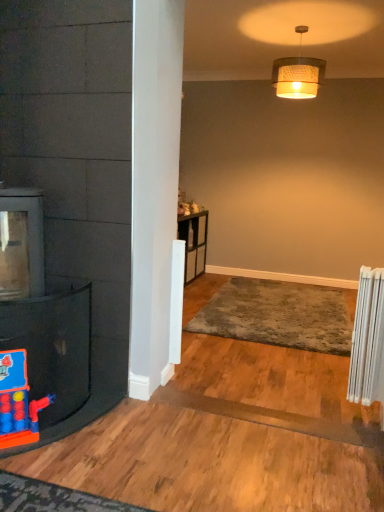
Locate an element on the screen. The height and width of the screenshot is (512, 384). vacant space behind rubberized plastic toy at left is located at coordinates (49, 419).